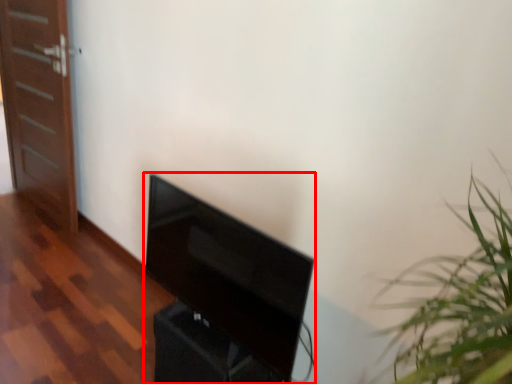
Question: Where is furniture (annotated by the red box) located in relation to door in the image?

Choices:
 (A) right
 (B) left

Answer: (A)